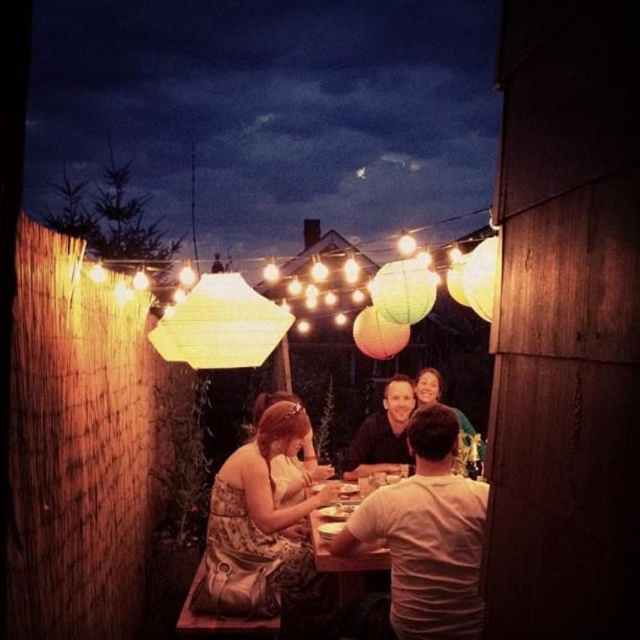
Question: Can you confirm if white cotton t-shirt at center is wider than smooth brown hair at center?

Choices:
 (A) yes
 (B) no

Answer: (A)

Question: Is patterned fabric dress at center below matte black shirt at center?

Choices:
 (A) yes
 (B) no

Answer: (A)

Question: Where is matte black shirt at center located in relation to wooden table at center in the image?

Choices:
 (A) left
 (B) right

Answer: (B)

Question: Which point is closer to the camera?

Choices:
 (A) (268, 522)
 (B) (476, 442)
 (C) (364, 568)

Answer: (C)

Question: Which object is positioned closest to the matte black shirt at center?

Choices:
 (A) smooth brown hair at center
 (B) white cotton t-shirt at center

Answer: (A)

Question: Based on their relative distances, which object is farther from the patterned fabric dress at center?

Choices:
 (A) white cotton t-shirt at center
 (B) matte black shirt at center
 (C) wooden table at center

Answer: (A)